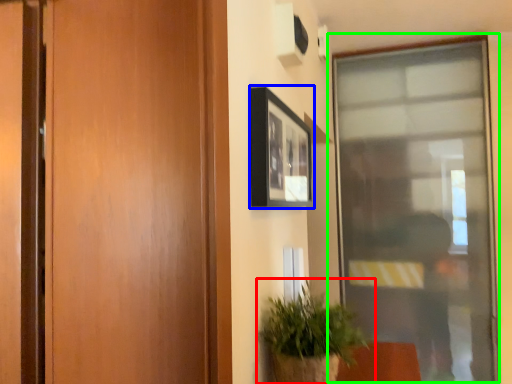
Question: Considering the real-world distances, which object is closest to houseplant (highlighted by a red box)? picture frame (highlighted by a blue box) or window (highlighted by a green box).

Choices:
 (A) picture frame
 (B) window

Answer: (A)